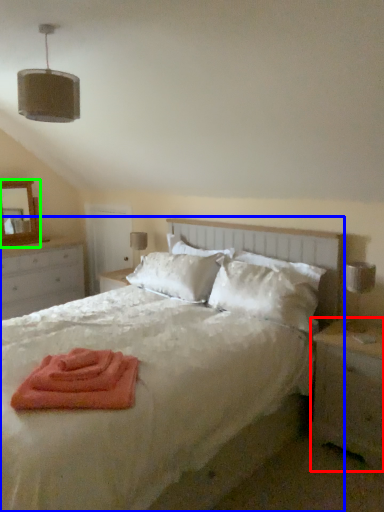
Question: Based on their relative distances, which object is farther from nightstand (highlighted by a red box)? Choose from bed (highlighted by a blue box) and mirror (highlighted by a green box).

Choices:
 (A) bed
 (B) mirror

Answer: (B)